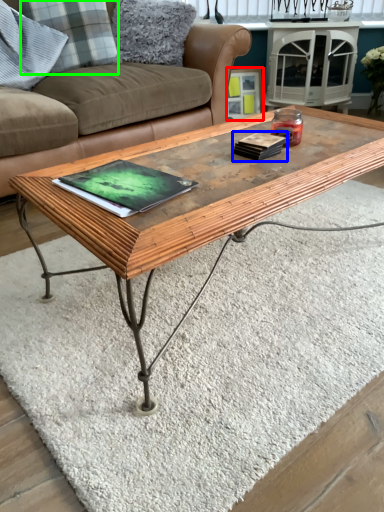
Question: Estimate the real-world distances between objects in this image. Which object is closer to picture frame (highlighted by a red box), book (highlighted by a blue box) or pillow (highlighted by a green box)?

Choices:
 (A) book
 (B) pillow

Answer: (B)